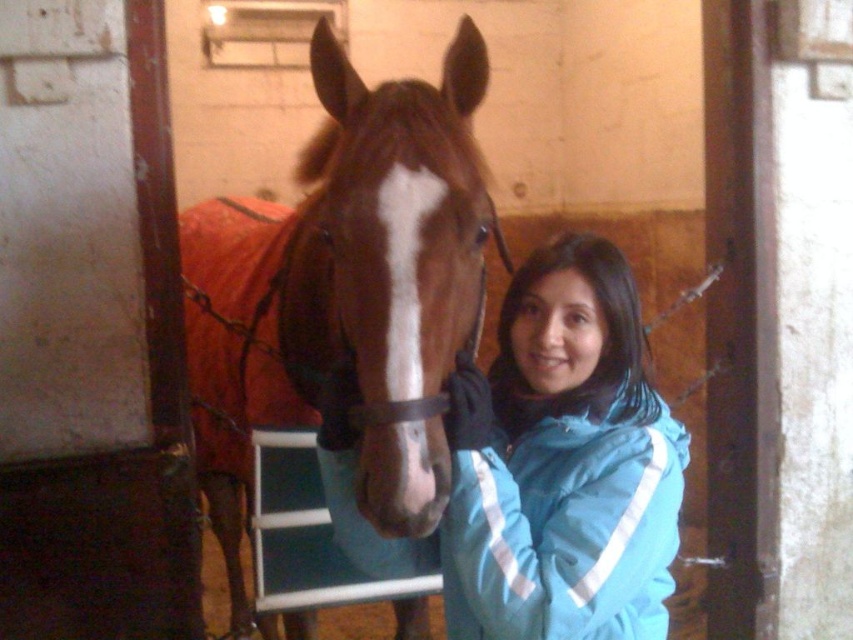
Question: Does brown glossy horse at center have a greater width compared to blue synthetic jacket at center?

Choices:
 (A) yes
 (B) no

Answer: (A)

Question: Does brown glossy horse at center have a smaller size compared to blue synthetic jacket at center?

Choices:
 (A) no
 (B) yes

Answer: (A)

Question: Among these objects, which one is nearest to the camera?

Choices:
 (A) blue synthetic jacket at center
 (B) brown glossy horse at center

Answer: (B)

Question: Does brown glossy horse at center have a lesser width compared to blue synthetic jacket at center?

Choices:
 (A) yes
 (B) no

Answer: (B)

Question: Which point is farther to the camera?

Choices:
 (A) blue synthetic jacket at center
 (B) brown glossy horse at center

Answer: (A)